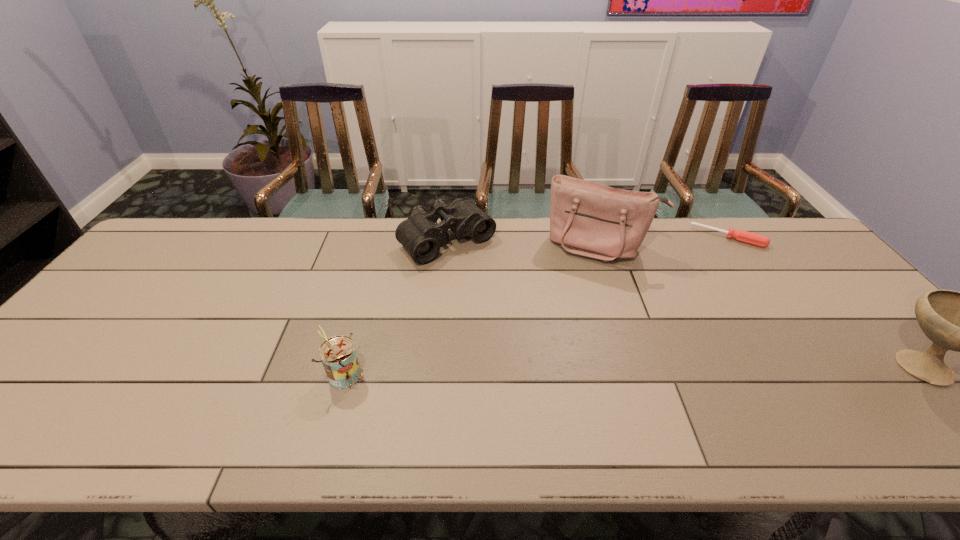
Where is `shoulder bag positioned at the far edge`? This screenshot has height=540, width=960. shoulder bag positioned at the far edge is located at coordinates (589, 219).

Where is `object that is at the near edge`? Image resolution: width=960 pixels, height=540 pixels. object that is at the near edge is located at coordinates (338, 354).

Locate an element on the screen. Image resolution: width=960 pixels, height=540 pixels. object present at the right edge is located at coordinates (743, 236).

The image size is (960, 540). Find the location of `object present at the far right corner`. object present at the far right corner is located at coordinates (743, 236).

Locate an element on the screen. vacant area at the far edge of the desktop is located at coordinates (710, 219).

Locate an element on the screen. Image resolution: width=960 pixels, height=540 pixels. vacant position at the near edge of the desktop is located at coordinates (129, 384).

Where is `free space at the left edge of the desktop`? This screenshot has width=960, height=540. free space at the left edge of the desktop is located at coordinates (140, 296).

Find the location of a particular element. This screenshot has width=960, height=540. vacant space at the right edge of the desktop is located at coordinates 808,267.

This screenshot has width=960, height=540. Find the location of `free space at the far left corner of the desktop`. free space at the far left corner of the desktop is located at coordinates (183, 218).

This screenshot has height=540, width=960. Find the location of `free location at the far right corner`. free location at the far right corner is located at coordinates (780, 234).